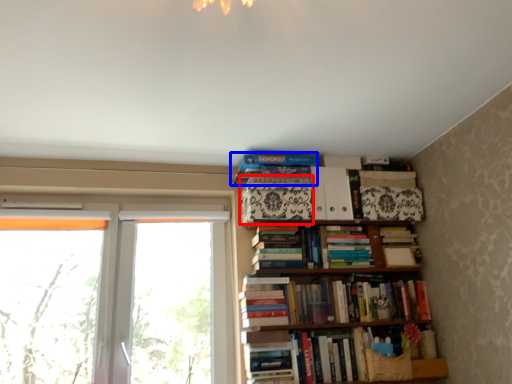
Question: Which object appears farthest to the camera in this image, paperback book (highlighted by a red box) or book (highlighted by a blue box)?

Choices:
 (A) paperback book
 (B) book

Answer: (B)